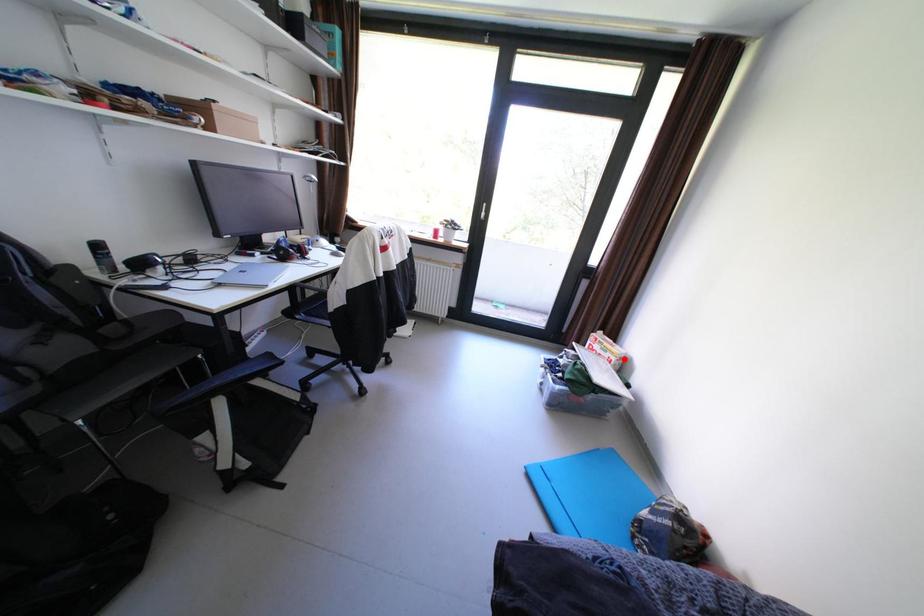
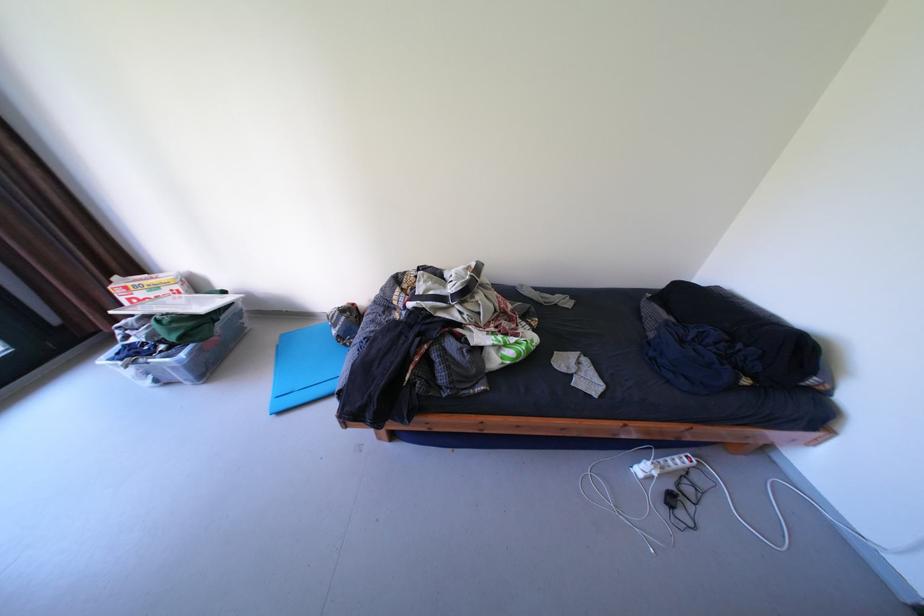
The point at the highlighted location is marked in the first image. Where is the corresponding point in the second image?

(188, 286)